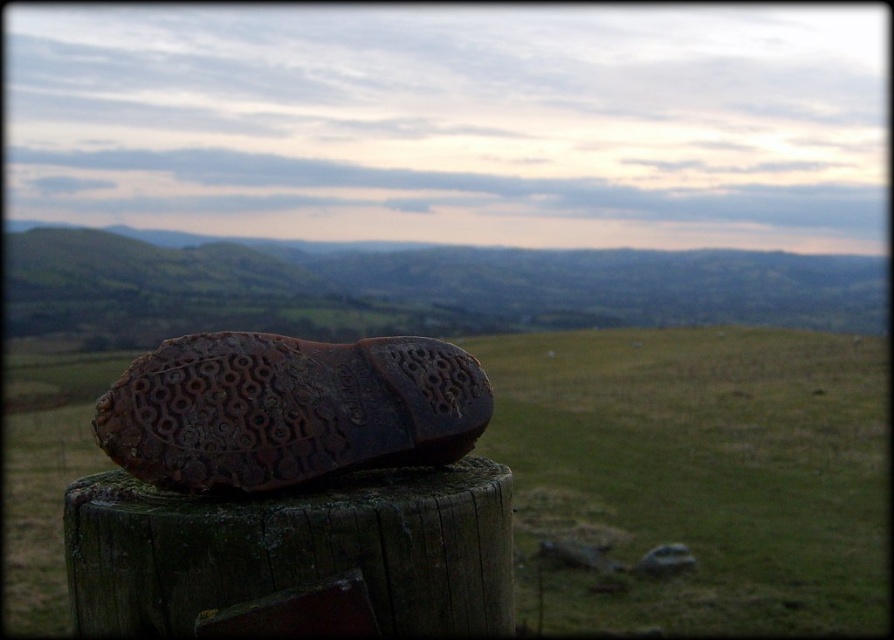
Question: Is brown leather shoe at center bigger than brown rubber shoe at center?

Choices:
 (A) yes
 (B) no

Answer: (A)

Question: Which point is farther to the camera?

Choices:
 (A) brown rubber shoe at center
 (B) brown leather shoe at center

Answer: (B)

Question: Is brown leather shoe at center bigger than brown rubber shoe at center?

Choices:
 (A) no
 (B) yes

Answer: (B)

Question: Is brown leather shoe at center in front of brown rubber shoe at center?

Choices:
 (A) no
 (B) yes

Answer: (A)

Question: Among these objects, which one is nearest to the camera?

Choices:
 (A) brown rubber shoe at center
 (B) brown leather shoe at center

Answer: (A)